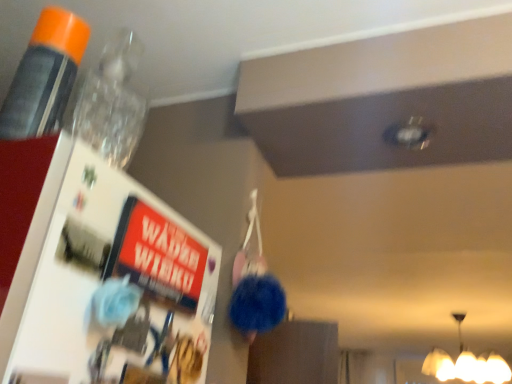
What do you see at coordinates (466, 364) in the screenshot?
I see `matte white lampshade at lower right` at bounding box center [466, 364].

I want to click on matte white lampshade at lower right, so click(466, 364).

Measure the distance between orange cap plastic bottle at upper left and camera.

orange cap plastic bottle at upper left and camera are 17.58 inches apart.

This screenshot has width=512, height=384. Identify the location of orange cap plastic bottle at upper left. (44, 75).

What do you see at coordinates (44, 75) in the screenshot? The image size is (512, 384). I see `orange cap plastic bottle at upper left` at bounding box center [44, 75].

At what (x,y) coordinates should I click in order to perform the action: click on matte white lampshade at lower right. Please return your answer as a coordinate pair (x, y). This screenshot has width=512, height=384. Looking at the image, I should click on (466, 364).

Which is more to the right, matte white lampshade at lower right or orange cap plastic bottle at upper left?

Positioned to the right is matte white lampshade at lower right.

Is matte white lampshade at lower right closer to camera compared to orange cap plastic bottle at upper left?

No, it is behind orange cap plastic bottle at upper left.

Does point (493, 360) come in front of point (12, 89)?

No, (493, 360) is further to viewer.

From the image's perspective, which is above, matte white lampshade at lower right or orange cap plastic bottle at upper left?

From the image's view, orange cap plastic bottle at upper left is above.

Based on the photo, from a real-world perspective, which object rests below the other?

orange cap plastic bottle at upper left.

Considering the relative sizes of matte white lampshade at lower right and orange cap plastic bottle at upper left in the image provided, is matte white lampshade at lower right wider than orange cap plastic bottle at upper left?

Correct, the width of matte white lampshade at lower right exceeds that of orange cap plastic bottle at upper left.

Considering the relative sizes of matte white lampshade at lower right and orange cap plastic bottle at upper left in the image provided, is matte white lampshade at lower right shorter than orange cap plastic bottle at upper left?

No, matte white lampshade at lower right is not shorter than orange cap plastic bottle at upper left.

Based on the photo, between matte white lampshade at lower right and orange cap plastic bottle at upper left, which one has smaller size?

Smaller between the two is orange cap plastic bottle at upper left.

Is orange cap plastic bottle at upper left located within matte white lampshade at lower right?

No, orange cap plastic bottle at upper left is not inside matte white lampshade at lower right.

Can you see matte white lampshade at lower right touching orange cap plastic bottle at upper left?

No, matte white lampshade at lower right is not in contact with orange cap plastic bottle at upper left.

Is matte white lampshade at lower right positioned with its back to orange cap plastic bottle at upper left?

That's right, matte white lampshade at lower right is facing away from orange cap plastic bottle at upper left.

Measure the distance from matte white lampshade at lower right to orange cap plastic bottle at upper left.

matte white lampshade at lower right and orange cap plastic bottle at upper left are 9.37 feet apart from each other.

Where is `lamp located above the orange cap plastic bottle at upper left (from a real-world perspective)`? This screenshot has height=384, width=512. lamp located above the orange cap plastic bottle at upper left (from a real-world perspective) is located at coordinates (466, 364).

Based on their positions, is orange cap plastic bottle at upper left located to the left or right of matte white lampshade at lower right?

orange cap plastic bottle at upper left is to the left of matte white lampshade at lower right.

Is orange cap plastic bottle at upper left behind matte white lampshade at lower right?

No, it is not.

Which is nearer, (74, 33) or (497, 354)?

The point (74, 33) is closer to the camera.

From the image's perspective, is orange cap plastic bottle at upper left over matte white lampshade at lower right?

Yes, from the image's perspective, orange cap plastic bottle at upper left is over matte white lampshade at lower right.

From a real-world perspective, is orange cap plastic bottle at upper left above or below matte white lampshade at lower right?

Clearly, from a real-world perspective, orange cap plastic bottle at upper left is below matte white lampshade at lower right.

Looking at their sizes, would you say orange cap plastic bottle at upper left is wider or thinner than matte white lampshade at lower right?

In the image, orange cap plastic bottle at upper left appears to be more narrow than matte white lampshade at lower right.

Is orange cap plastic bottle at upper left taller than matte white lampshade at lower right?

No.

Does orange cap plastic bottle at upper left have a smaller size compared to matte white lampshade at lower right?

Correct, orange cap plastic bottle at upper left occupies less space than matte white lampshade at lower right.

Is orange cap plastic bottle at upper left spatially inside matte white lampshade at lower right, or outside of it?

orange cap plastic bottle at upper left is located beyond the bounds of matte white lampshade at lower right.

Are orange cap plastic bottle at upper left and matte white lampshade at lower right far apart?

Indeed, orange cap plastic bottle at upper left is not near matte white lampshade at lower right.

Could you tell me if orange cap plastic bottle at upper left is facing matte white lampshade at lower right?

No, orange cap plastic bottle at upper left is not facing towards matte white lampshade at lower right.

How many degrees apart are the facing directions of orange cap plastic bottle at upper left and matte white lampshade at lower right?

174 degrees separate the facing orientations of orange cap plastic bottle at upper left and matte white lampshade at lower right.

I want to click on bottle above the matte white lampshade at lower right (from the image's perspective), so click(x=44, y=75).

Locate an element on the screen. bottle that is above the matte white lampshade at lower right (from the image's perspective) is located at coordinates coord(44,75).

Where is `bottle that appears on the left of matte white lampshade at lower right`? bottle that appears on the left of matte white lampshade at lower right is located at coordinates (44, 75).